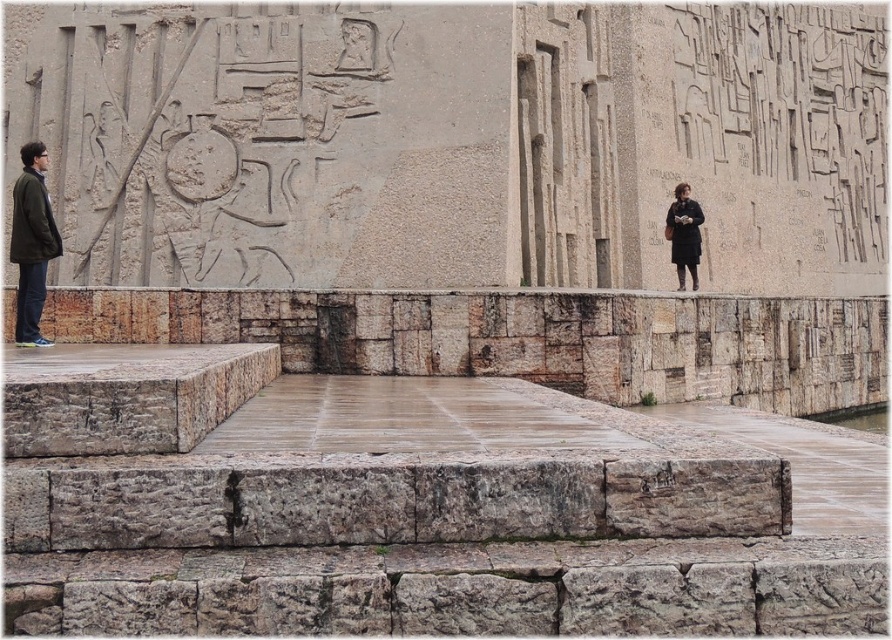
You are standing on the stone platform and notice the green matte jacket at left. Can you determine its exact position relative to the platform?

The green matte jacket at left is located at point coordinates of 0.380 on the x axis and 0.037 on the y axis relative to the platform.

You are a tour guide explaining the historical site to visitors. You notice the green matte jacket at left and the black matte coat at right. Which one is bigger in size?

The green matte jacket at left is larger in size compared to the black matte coat at right.

You are a tour guide explaining the ancient stone wall to visitors. You notice two visitors wearing the green matte jacket at left and the black matte coat at right. Which visitor is standing closer to the wall?

The green matte jacket at left is much taller than the black matte coat at right, so the visitor wearing the green matte jacket at left is standing closer to the wall.